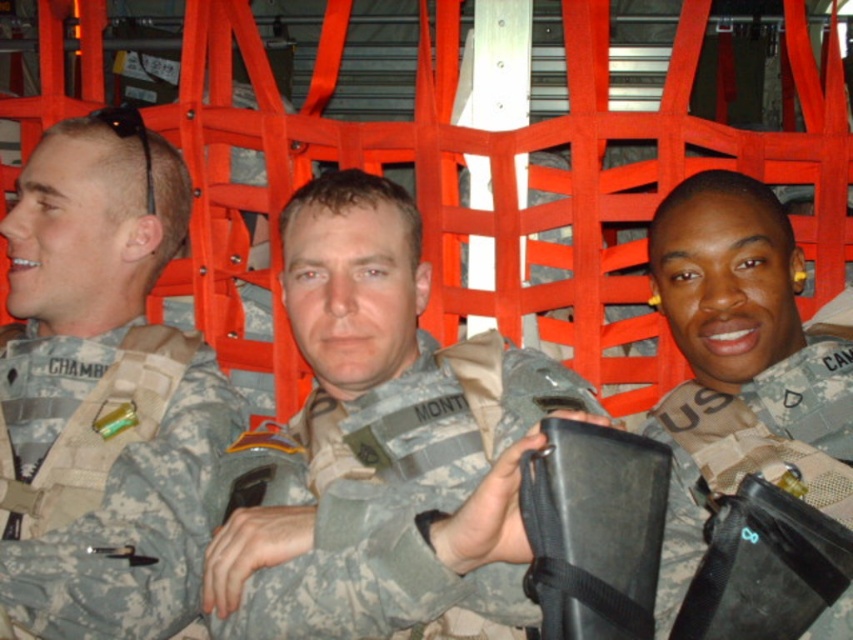
You are a photographer trying to capture a group photo of the camouflage fabric uniform at center and the camouflage fabric uniform at left. Which one should you focus on first to ensure both are in focus?

You should focus on the camouflage fabric uniform at center first because it is closer to the viewer than the camouflage fabric uniform at left, so adjusting focus from near to far will help both be in focus.

You are a military supply officer inspecting a soldier in the image. You need to determine the correct placement of the equipment. Which item is located to the left of the other between the camouflage fabric uniform at center and the camouflage fabric utility belt at center?

The camouflage fabric uniform at center is positioned on the left side of camouflage fabric utility belt at center, so it is located to the left of the utility belt.